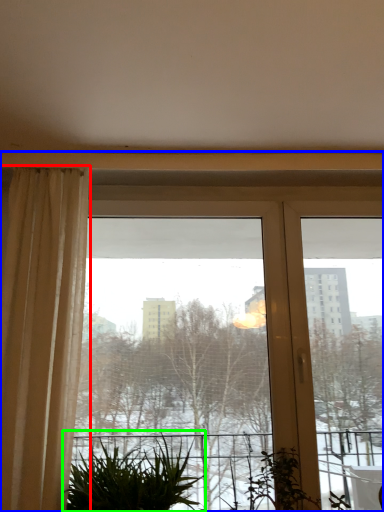
Question: Based on their relative distances, which object is nearer to curtain (highlighted by a red box)? Choose from window (highlighted by a blue box) and houseplant (highlighted by a green box).

Choices:
 (A) window
 (B) houseplant

Answer: (B)